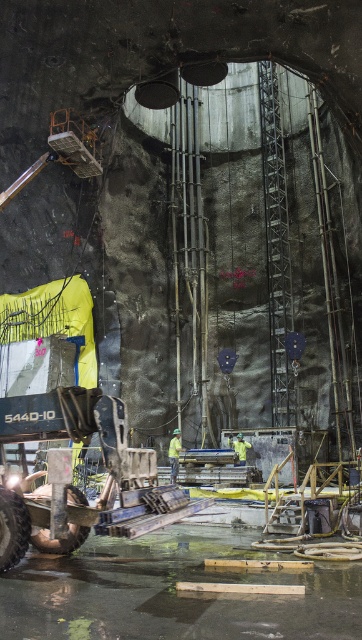
Question: Which is farther from the yellow fabric at center?

Choices:
 (A) yellow reflective safety vest at center
 (B) metallic gray machinery at lower left

Answer: (B)

Question: Can you confirm if yellow fabric at center is positioned to the right of yellow reflective safety vest at center?

Choices:
 (A) no
 (B) yes

Answer: (A)

Question: Estimate the real-world distances between objects in this image. Which object is farther from the yellow reflective safety vest at center?

Choices:
 (A) metallic gray machinery at lower left
 (B) yellow fabric at center

Answer: (A)

Question: Which is nearer to the yellow reflective safety vest at center?

Choices:
 (A) metallic gray machinery at lower left
 (B) yellow fabric at center

Answer: (B)

Question: Can you confirm if yellow fabric at center is wider than yellow reflective safety vest at center?

Choices:
 (A) no
 (B) yes

Answer: (A)

Question: Does yellow fabric at center come behind yellow reflective safety vest at center?

Choices:
 (A) no
 (B) yes

Answer: (A)